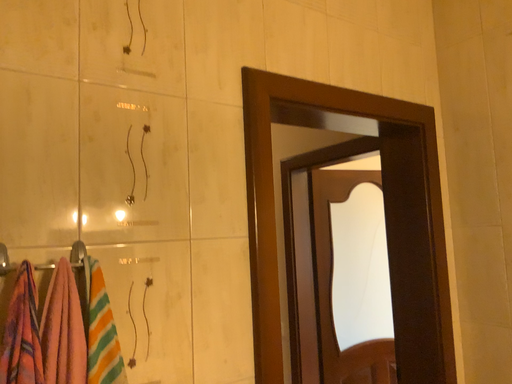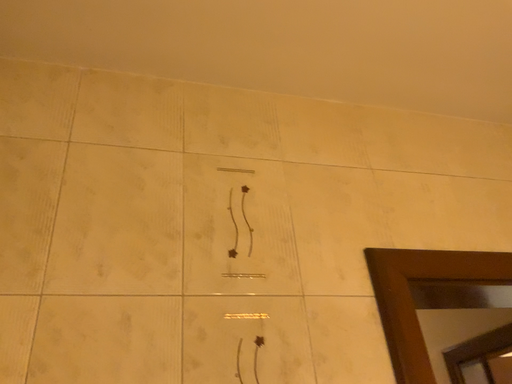
Question: Which way did the camera rotate in the video?

Choices:
 (A) rotated upward
 (B) rotated downward

Answer: (A)